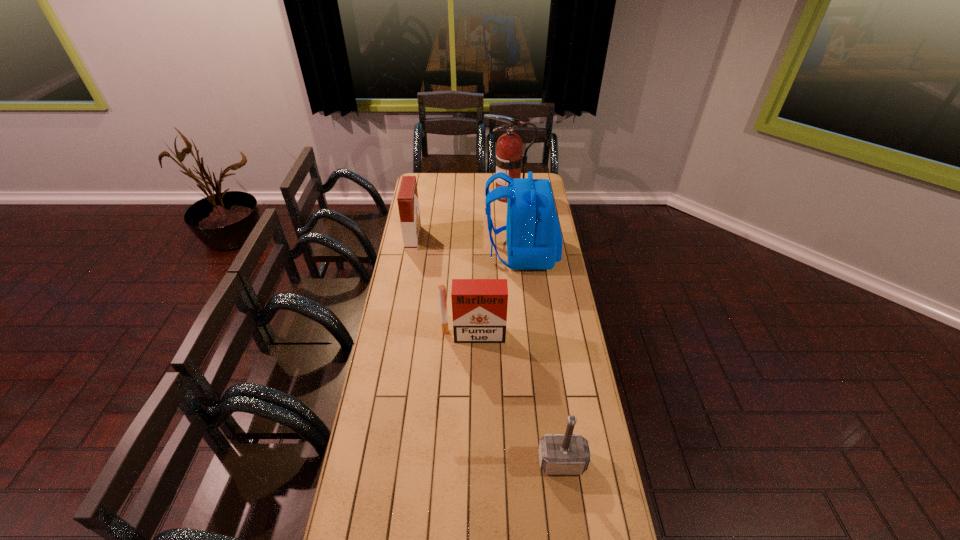
In order to click on fire extinguisher in this screenshot , I will do `click(508, 159)`.

Identify the location of backpack. (534, 241).

Identify the location of the left cigarette case. (408, 204).

At what (x,y) coordinates should I click in order to perform the action: click on the farther cigarette case. Please return your answer as a coordinate pair (x, y). Looking at the image, I should click on (408, 204).

This screenshot has width=960, height=540. I want to click on the nearer cigarette case, so click(479, 306).

At what (x,y) coordinates should I click in order to perform the action: click on the fourth farthest object. Please return your answer as a coordinate pair (x, y). This screenshot has width=960, height=540. Looking at the image, I should click on (479, 306).

I want to click on the nearest object, so click(559, 454).

At what (x,y) coordinates should I click in order to perform the action: click on vacant space located at the nozzle of the fire extinguisher. Please return your answer as a coordinate pair (x, y). This screenshot has height=540, width=960. Looking at the image, I should click on (453, 196).

This screenshot has height=540, width=960. In order to click on vacant area located 0.260m at the nozzle of the fire extinguisher in this screenshot , I will do `click(442, 196)`.

This screenshot has height=540, width=960. Find the location of `free space located at the nozzle of the fire extinguisher`. free space located at the nozzle of the fire extinguisher is located at coordinates (474, 196).